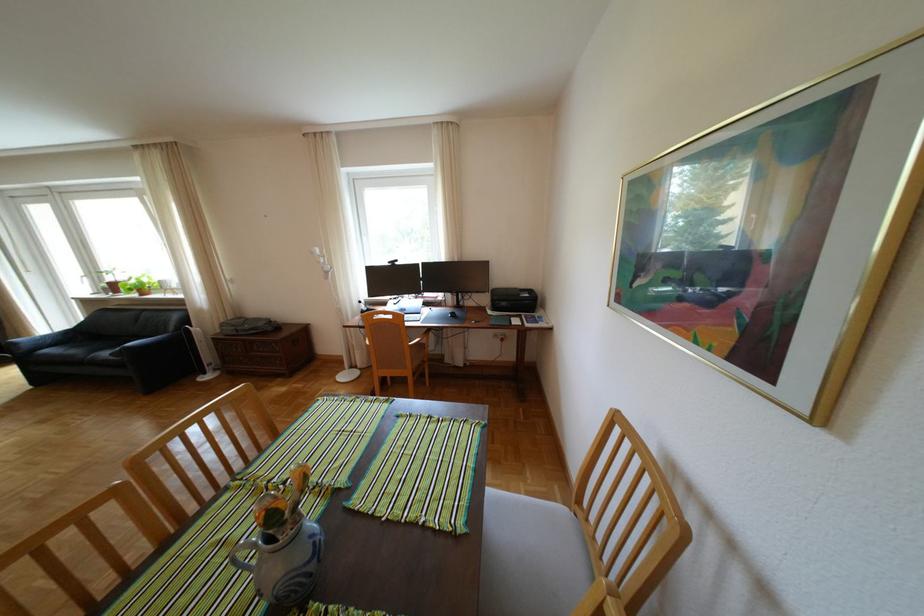
Identify the location of ceramic pitcher handle. The image size is (924, 616). (283, 544).